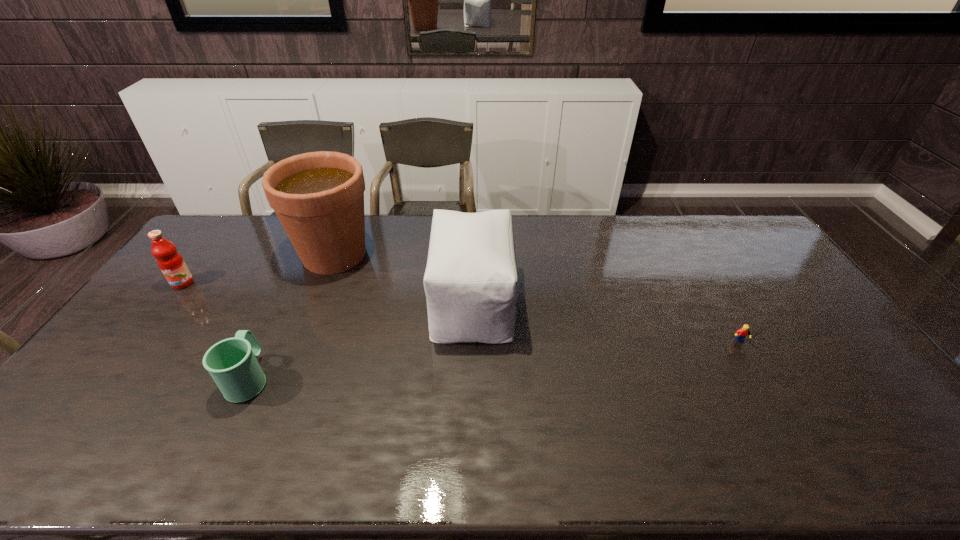
Image resolution: width=960 pixels, height=540 pixels. In order to click on free space at the left edge of the desktop in this screenshot , I will do `click(209, 274)`.

Where is `vacant space at the right edge of the desktop`? This screenshot has height=540, width=960. vacant space at the right edge of the desktop is located at coordinates (738, 267).

Where is `vacant space at the far left corner of the desktop`? vacant space at the far left corner of the desktop is located at coordinates (205, 230).

The height and width of the screenshot is (540, 960). Find the location of `vacant space at the far right corner of the desktop`. vacant space at the far right corner of the desktop is located at coordinates (730, 249).

Identify the location of free spot between the fourth object from left to right and the flowerpot. (403, 278).

You are a GUI agent. You are given a task and a screenshot of the screen. Output one action in this format:
    pyautogui.click(x=<x>, y=<y>)
    Task: Click on the vacant space that is in between the second tallest object and the mug
    
    Given the screenshot: What is the action you would take?
    pyautogui.click(x=361, y=340)

Identify the location of vacant region between the tallest object and the mug. (292, 316).

You are a GUI agent. You are given a task and a screenshot of the screen. Output one action in this format:
    pyautogui.click(x=<x>, y=<y>)
    Task: Click on the free space between the second tallest object and the leftmost object
    The image size is (960, 540).
    Given the screenshot: What is the action you would take?
    pyautogui.click(x=327, y=292)

At what (x,y) coordinates should I click in order to perform the action: click on empty space that is in between the fourth shortest object and the fruit juice. Please return your answer as a coordinate pair (x, y). Looking at the image, I should click on (327, 292).

Identify the location of empty space that is in between the tallest object and the rightmost object. tap(539, 299).